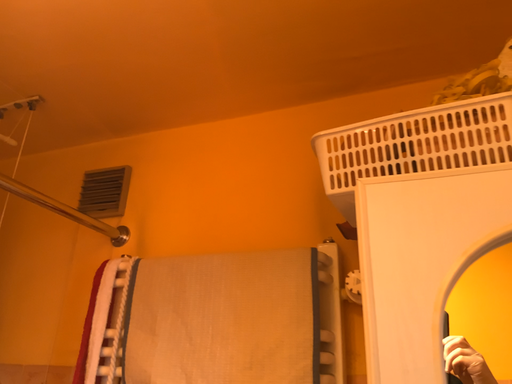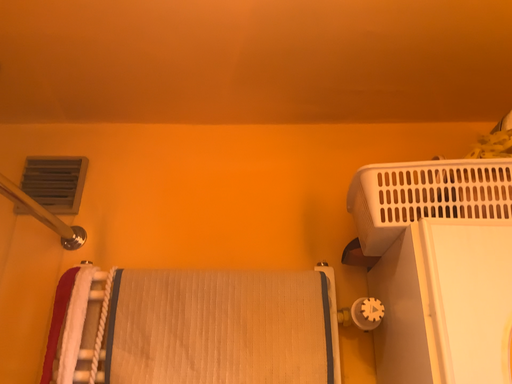
Question: How did the camera likely rotate when shooting the video?

Choices:
 (A) rotated left
 (B) rotated right

Answer: (B)